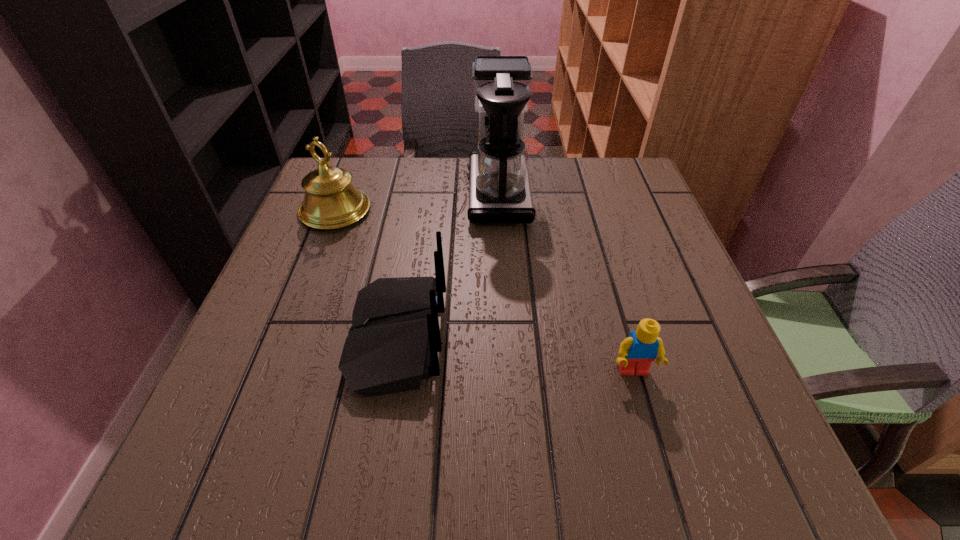
Where is `blank area located 0.370m on the back of the router`? The width and height of the screenshot is (960, 540). blank area located 0.370m on the back of the router is located at coordinates (654, 338).

Identify the location of free space located 0.050m on the front-facing side of the shortest object. The height and width of the screenshot is (540, 960). click(x=644, y=411).

Identify the location of coffee maker at the far edge. (500, 192).

Identify the location of bell located at the far edge. This screenshot has width=960, height=540. (331, 201).

What are the coordinates of `object located at the left edge` in the screenshot? It's located at (331, 201).

Identify the location of object positioned at the right edge. (637, 352).

Image resolution: width=960 pixels, height=540 pixels. In order to click on object that is at the far left corner in this screenshot , I will do `click(331, 201)`.

You are a GUI agent. You are given a task and a screenshot of the screen. Output one action in this format:
    pyautogui.click(x=<x>, y=<y>)
    Task: Click on the free space at the far edge of the desktop
    Image resolution: width=960 pixels, height=540 pixels.
    Given the screenshot: What is the action you would take?
    pyautogui.click(x=555, y=164)

The image size is (960, 540). Identify the location of vacant space at the near edge of the desktop. (379, 435).

This screenshot has height=540, width=960. In order to click on blank space at the left edge of the desktop in this screenshot , I will do `click(304, 240)`.